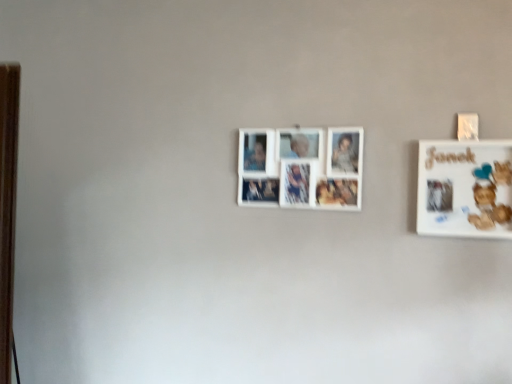
Question: Does white matte board at upper right, the 1th picture frame when ordered from front to back, appear on the right side of white matte picture frame at center, the 1th picture frame in the left-to-right sequence?

Choices:
 (A) yes
 (B) no

Answer: (A)

Question: Is white matte board at upper right, the 1th picture frame when ordered from front to back, facing towards white matte picture frame at center, the 1th picture frame in the left-to-right sequence?

Choices:
 (A) no
 (B) yes

Answer: (A)

Question: Does white matte board at upper right, the 1th picture frame when ordered from right to left, have a lesser width compared to white matte picture frame at center, the 2th picture frame in the right-to-left sequence?

Choices:
 (A) yes
 (B) no

Answer: (B)

Question: Is white matte board at upper right, the 1th picture frame when ordered from front to back, outside white matte picture frame at center, the first picture frame positioned from the back?

Choices:
 (A) yes
 (B) no

Answer: (A)

Question: Does white matte board at upper right, the 2th picture frame in the left-to-right sequence, have a smaller size compared to white matte picture frame at center, the 2th picture frame positioned from the front?

Choices:
 (A) no
 (B) yes

Answer: (B)

Question: Is white matte board at upper right, the 2th picture frame in the left-to-right sequence, positioned far away from white matte picture frame at center, the 2th picture frame positioned from the front?

Choices:
 (A) no
 (B) yes

Answer: (A)

Question: From a real-world perspective, is white matte picture frame at center, the 1th picture frame in the left-to-right sequence, located higher than white matte board at upper right, the 1th picture frame when ordered from front to back?

Choices:
 (A) no
 (B) yes

Answer: (B)

Question: Could you tell me if white matte picture frame at center, the 1th picture frame in the left-to-right sequence, is facing white matte board at upper right, the 1th picture frame when ordered from front to back?

Choices:
 (A) no
 (B) yes

Answer: (A)

Question: Is white matte picture frame at center, the 2th picture frame in the right-to-left sequence, smaller than white matte board at upper right, the 2th picture frame from the back?

Choices:
 (A) yes
 (B) no

Answer: (B)

Question: Is white matte picture frame at center, the 2th picture frame positioned from the front, outside white matte board at upper right, the 1th picture frame when ordered from right to left?

Choices:
 (A) yes
 (B) no

Answer: (A)

Question: Is white matte picture frame at center, the first picture frame positioned from the back, looking in the opposite direction of white matte board at upper right, the 1th picture frame when ordered from right to left?

Choices:
 (A) no
 (B) yes

Answer: (A)

Question: Does white matte picture frame at center, the first picture frame positioned from the back, come behind white matte board at upper right, the 2th picture frame in the left-to-right sequence?

Choices:
 (A) yes
 (B) no

Answer: (A)

Question: Considering the positions of white matte board at upper right, the 2th picture frame in the left-to-right sequence, and white matte picture frame at center, the 2th picture frame positioned from the front, in the image, is white matte board at upper right, the 2th picture frame in the left-to-right sequence, wider or thinner than white matte picture frame at center, the 2th picture frame positioned from the front,?

Choices:
 (A) thin
 (B) wide

Answer: (B)